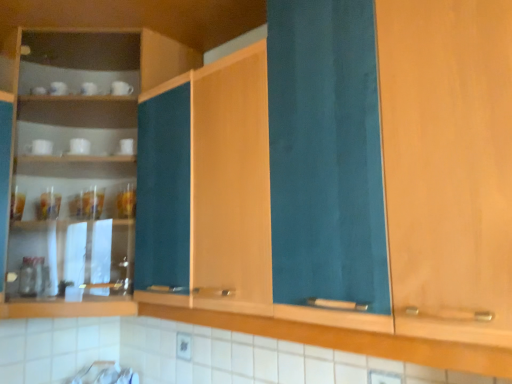
Question: Is white glossy cup at left facing towards wooden cabinet at left, the 2th cabinetry from the right?

Choices:
 (A) no
 (B) yes

Answer: (B)

Question: From the image's perspective, would you say white glossy cup at left is shown under wooden cabinet at left, which ranks as the first cabinetry in left-to-right order?

Choices:
 (A) no
 (B) yes

Answer: (A)

Question: Is white glossy cup at left far from wooden cabinet at left, the 2th cabinetry from the right?

Choices:
 (A) yes
 (B) no

Answer: (B)

Question: Is white glossy cup at left wider than wooden cabinet at left, the 2th cabinetry from the right?

Choices:
 (A) yes
 (B) no

Answer: (B)

Question: Is white glossy cup at left positioned before wooden cabinet at left, which ranks as the first cabinetry in left-to-right order?

Choices:
 (A) yes
 (B) no

Answer: (B)

Question: Considering the relative sizes of white glossy cup at left and wooden cabinet at left, the 2th cabinetry from the right, in the image provided, is white glossy cup at left thinner than wooden cabinet at left, the 2th cabinetry from the right,?

Choices:
 (A) no
 (B) yes

Answer: (B)

Question: Is wooden cabinet at left, which ranks as the first cabinetry in left-to-right order, thinner than white glossy cup at left?

Choices:
 (A) no
 (B) yes

Answer: (A)

Question: Can you confirm if wooden cabinet at left, which ranks as the first cabinetry in left-to-right order, is positioned to the right of white glossy cup at left?

Choices:
 (A) no
 (B) yes

Answer: (B)

Question: Considering the relative positions of wooden cabinet at left, the 2th cabinetry from the right, and white glossy cup at left in the image provided, is wooden cabinet at left, the 2th cabinetry from the right, behind white glossy cup at left?

Choices:
 (A) yes
 (B) no

Answer: (B)

Question: From a real-world perspective, is wooden cabinet at left, the 2th cabinetry from the right, over white glossy cup at left?

Choices:
 (A) yes
 (B) no

Answer: (B)

Question: From a real-world perspective, is wooden cabinet at left, the 2th cabinetry from the right, below white glossy cup at left?

Choices:
 (A) yes
 (B) no

Answer: (A)

Question: Does wooden cabinet at left, the 2th cabinetry from the right, have a lesser height compared to white glossy cup at left?

Choices:
 (A) no
 (B) yes

Answer: (A)

Question: From the image's perspective, is teal fabric cabinet at center, which is counted as the 2th cabinetry, starting from the left, on white glossy cup at left?

Choices:
 (A) no
 (B) yes

Answer: (A)